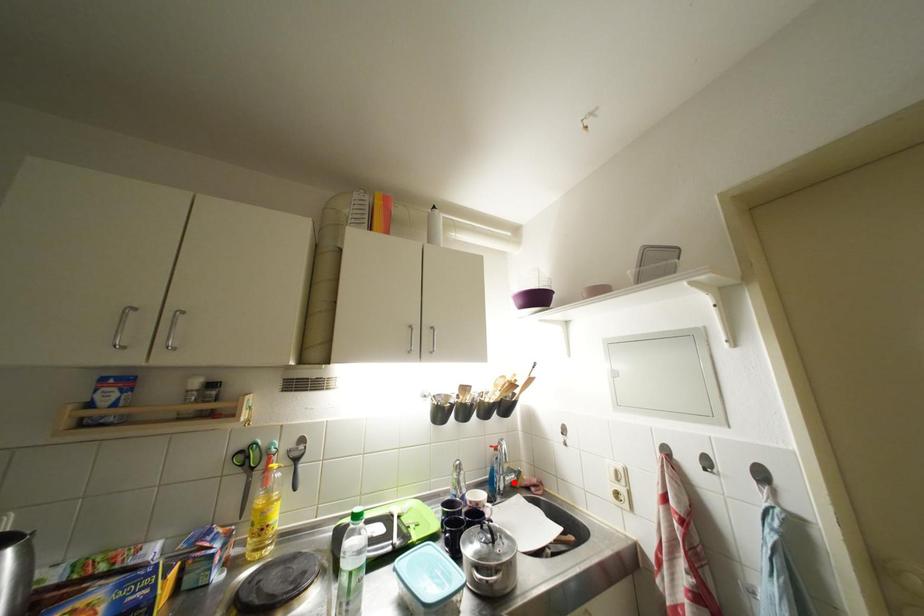
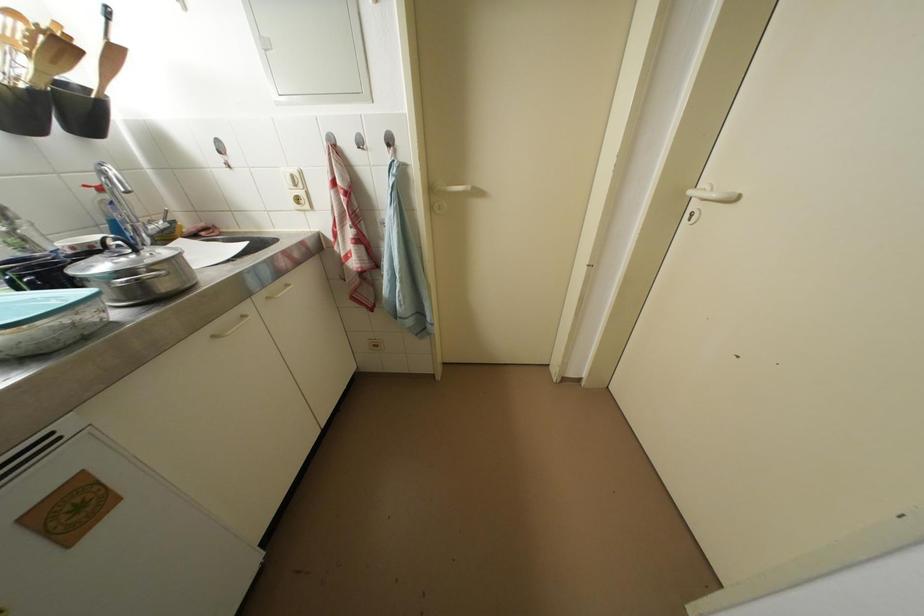
Question: I am providing you with two images of the same scene from different viewpoints. A red point is marked on the first image. Can you still see the location of the red point in image 2?

Choices:
 (A) Yes
 (B) No

Answer: (A)